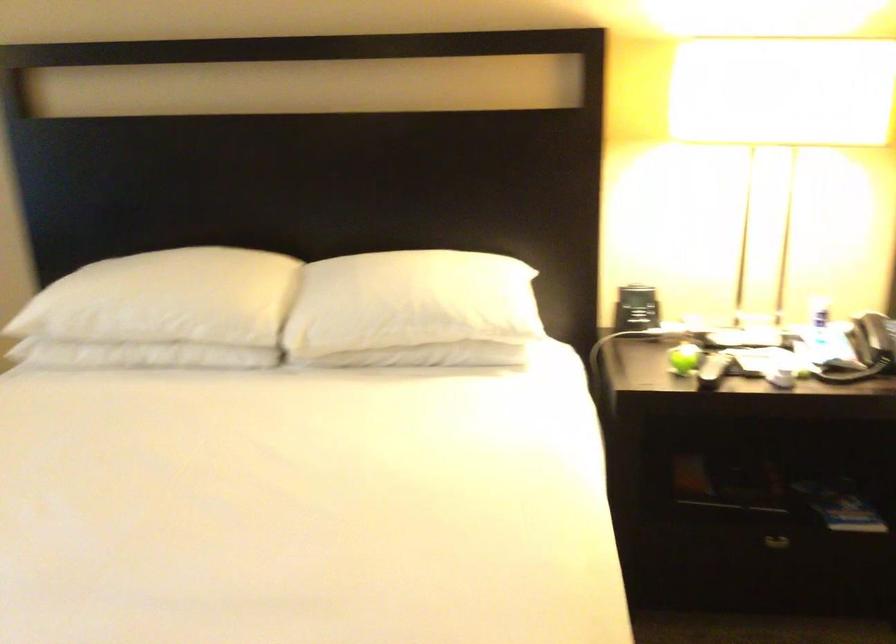
Find the location of a particular element. The image size is (896, 644). nightstand drawer handle is located at coordinates (771, 540).